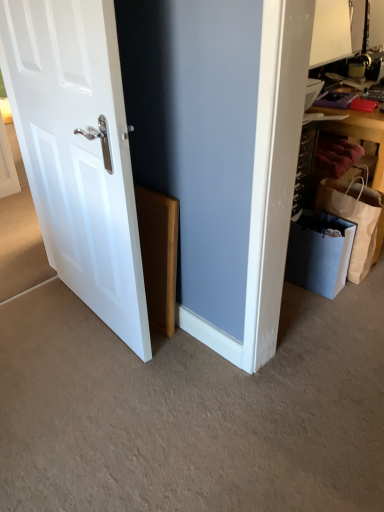
Locate an element on the screen. The width and height of the screenshot is (384, 512). white paper shopping bag at right is located at coordinates (354, 219).

The height and width of the screenshot is (512, 384). What do you see at coordinates (354, 219) in the screenshot?
I see `white paper shopping bag at right` at bounding box center [354, 219].

Find the location of a particular element. This screenshot has width=384, height=512. white glossy door at left is located at coordinates [78, 152].

Describe the element at coordinates (78, 152) in the screenshot. The image size is (384, 512). I see `white glossy door at left` at that location.

In order to click on white paper shopping bag at right in this screenshot , I will do [x=354, y=219].

Considering the relative positions of white paper shopping bag at right and white glossy door at left in the image provided, is white paper shopping bag at right to the left of white glossy door at left from the viewer's perspective?

No.

Considering the positions of objects white paper shopping bag at right and white glossy door at left in the image provided, who is behind, white paper shopping bag at right or white glossy door at left?

white paper shopping bag at right is behind.

Is point (360, 233) closer to camera compared to point (95, 35)?

No.

From the image's perspective, is white paper shopping bag at right beneath white glossy door at left?

Yes.

From the picture: From a real-world perspective, who is located higher, white paper shopping bag at right or white glossy door at left?

white glossy door at left is physically above.

Does white paper shopping bag at right have a greater width compared to white glossy door at left?

Correct, the width of white paper shopping bag at right exceeds that of white glossy door at left.

Is white paper shopping bag at right taller or shorter than white glossy door at left?

white paper shopping bag at right is shorter than white glossy door at left.

Can you confirm if white paper shopping bag at right is smaller than white glossy door at left?

Correct, white paper shopping bag at right occupies less space than white glossy door at left.

Is white paper shopping bag at right inside the boundaries of white glossy door at left, or outside?

white paper shopping bag at right is located beyond the bounds of white glossy door at left.

Are white paper shopping bag at right and white glossy door at left beside each other?

No, white paper shopping bag at right is not making contact with white glossy door at left.

Is white paper shopping bag at right oriented away from white glossy door at left?

No, white paper shopping bag at right's orientation is not away from white glossy door at left.

What's the angular difference between white paper shopping bag at right and white glossy door at left's facing directions?

There is a 98.5-degree angle between the facing directions of white paper shopping bag at right and white glossy door at left.

Identify the location of shopping bag below the white glossy door at left (from the image's perspective). (354, 219).

Which is more to the right, white glossy door at left or white paper shopping bag at right?

From the viewer's perspective, white paper shopping bag at right appears more on the right side.

Considering their positions, is white glossy door at left located in front of or behind white paper shopping bag at right?

In the image, white glossy door at left appears in front of white paper shopping bag at right.

Is point (53, 221) closer or farther from the camera than point (349, 199)?

Point (53, 221) is closer to the camera than point (349, 199).

From the image's perspective, between white glossy door at left and white paper shopping bag at right, which one is located above?

From the image's view, white glossy door at left is above.

Based on the photo, from a real-world perspective, is white glossy door at left physically below white paper shopping bag at right?

No.

Can you confirm if white glossy door at left is thinner than white paper shopping bag at right?

Yes.

In terms of height, does white glossy door at left look taller or shorter compared to white paper shopping bag at right?

Clearly, white glossy door at left is taller compared to white paper shopping bag at right.

Can you confirm if white glossy door at left is bigger than white paper shopping bag at right?

Yes.

Can we say white glossy door at left lies outside white paper shopping bag at right?

Yes, white glossy door at left is not within white paper shopping bag at right.

Are white glossy door at left and white paper shopping bag at right located far from each other?

Yes.

Is white glossy door at left aimed at white paper shopping bag at right?

No, white glossy door at left is not facing towards white paper shopping bag at right.

Measure the distance between white glossy door at left and white paper shopping bag at right.

A distance of 3.88 feet exists between white glossy door at left and white paper shopping bag at right.

Locate an element on the screen. This screenshot has height=512, width=384. door above the white paper shopping bag at right (from the image's perspective) is located at coordinates (78, 152).

Locate an element on the screen. This screenshot has height=512, width=384. shopping bag that appears below the white glossy door at left (from a real-world perspective) is located at coordinates (354, 219).

Identify the location of door lying on the left of white paper shopping bag at right. [78, 152].